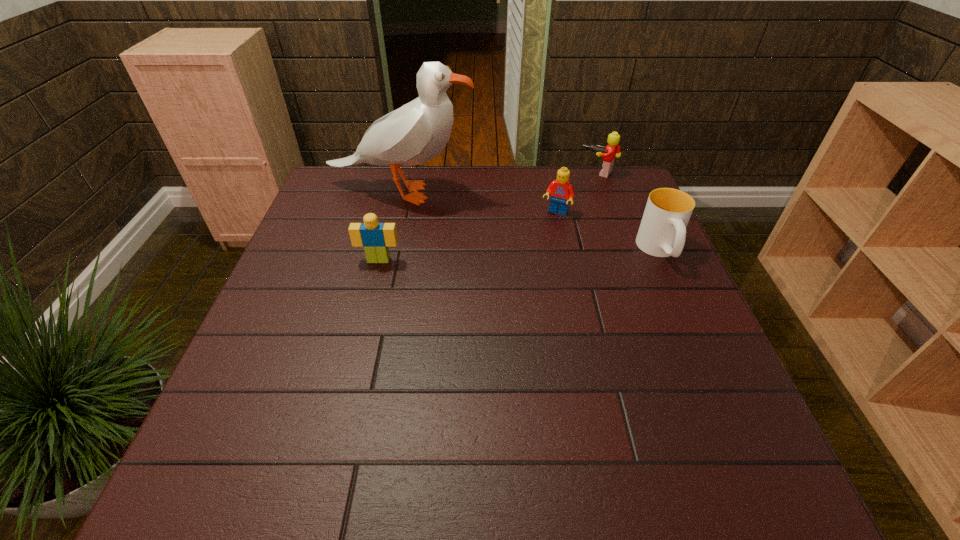
You are a GUI agent. You are given a task and a screenshot of the screen. Output one action in this format:
    pyautogui.click(x=<x>, y=<y>)
    Task: Click on the object that is the fourth closest to the gull
    
    Given the screenshot: What is the action you would take?
    [x=662, y=232]

Select which Lego is the closest to the gull. Please provide its 2D coordinates. Your answer should be formatted as a tuple, i.e. [(x, y)], where the tuple contains the x and y coordinates of a point satisfying the conditions above.

[(561, 190)]

Find the location of a particular element. The image size is (960, 540). Lego identified as the closest to the rightmost Lego is located at coordinates (561, 190).

Image resolution: width=960 pixels, height=540 pixels. I want to click on vacant region that satisfies the following two spatial constraints: 1. on the back side of the gull; 2. on the left side of the rightmost Lego, so click(x=405, y=173).